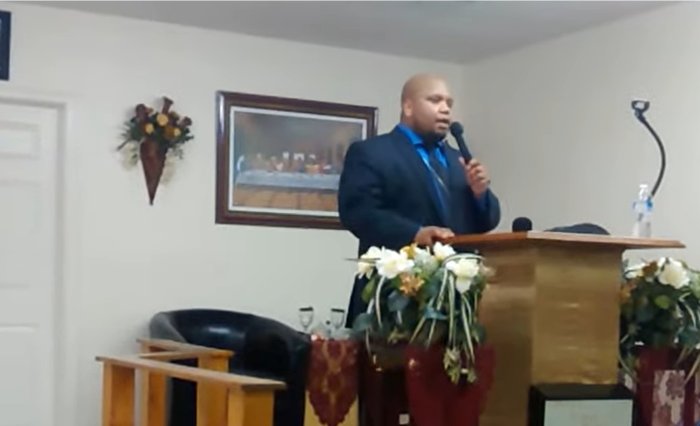
Identify the location of door. This screenshot has width=700, height=426. (19, 228).